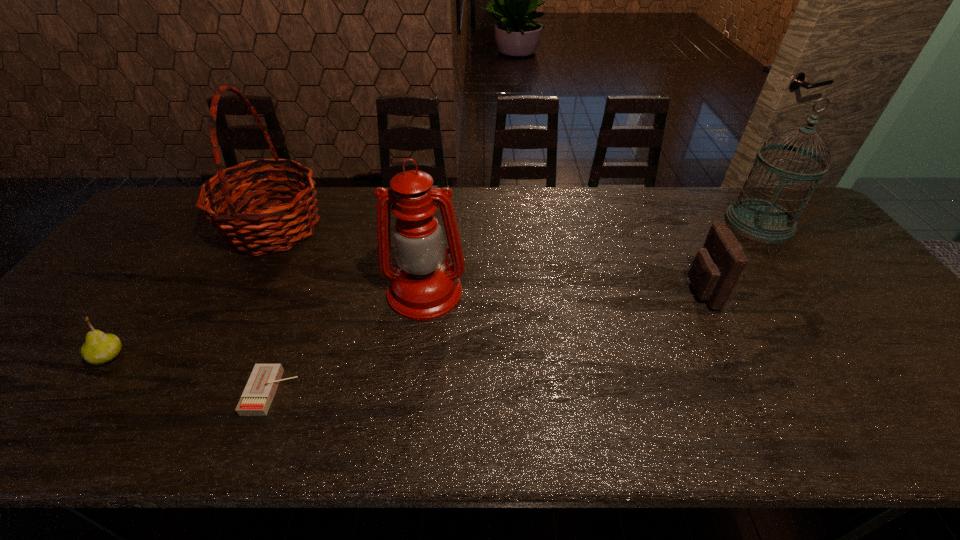
Locate an element on the screen. object that is positioned at the right edge is located at coordinates (759, 220).

This screenshot has height=540, width=960. What are the coordinates of `object that is at the far right corner` in the screenshot? It's located at (759, 220).

At what (x,y) coordinates should I click in order to perform the action: click on vacant space at the far edge. Please return your answer as a coordinate pair (x, y). The height and width of the screenshot is (540, 960). Looking at the image, I should click on click(643, 211).

The height and width of the screenshot is (540, 960). In order to click on free spot at the near edge of the desktop in this screenshot , I will do `click(58, 434)`.

The height and width of the screenshot is (540, 960). Identify the location of free spot at the near right corner of the desktop. (954, 409).

I want to click on unoccupied position between the oil lamp and the matchbox, so click(348, 342).

Where is `free space between the third object from right to left and the matchbox`? Image resolution: width=960 pixels, height=540 pixels. free space between the third object from right to left and the matchbox is located at coordinates (348, 342).

This screenshot has width=960, height=540. In order to click on free area in between the basket and the matchbox in this screenshot , I will do `click(273, 310)`.

Where is `free point between the birdcage and the basket`? Image resolution: width=960 pixels, height=540 pixels. free point between the birdcage and the basket is located at coordinates (516, 226).

Where is `empty space that is in between the fourth object from left to right and the pear`? empty space that is in between the fourth object from left to right and the pear is located at coordinates (267, 325).